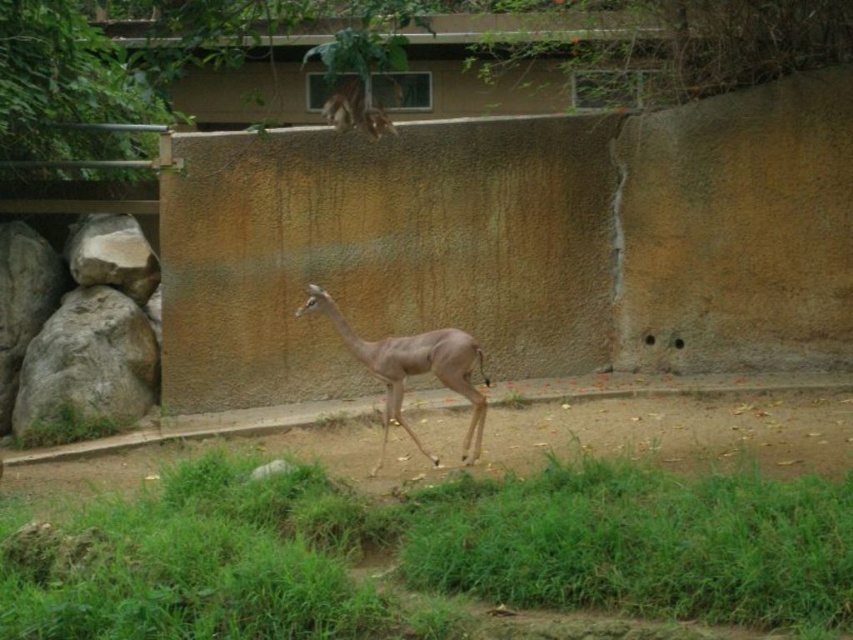
Does green grass at lower center have a larger size compared to light brown fur at center?

Yes, green grass at lower center is bigger than light brown fur at center.

Which is behind, point (378, 600) or point (378, 344)?

Positioned behind is point (378, 344).

Identify the location of green grass at lower center. pyautogui.click(x=427, y=552).